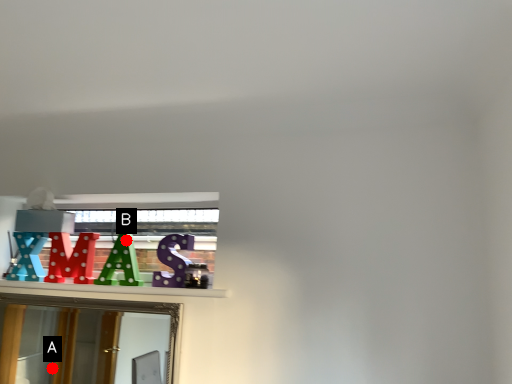
Question: Two points are circled on the image, labeled by A and B beside each circle. Which point is closer to the camera?

Choices:
 (A) A is closer
 (B) B is closer

Answer: (B)